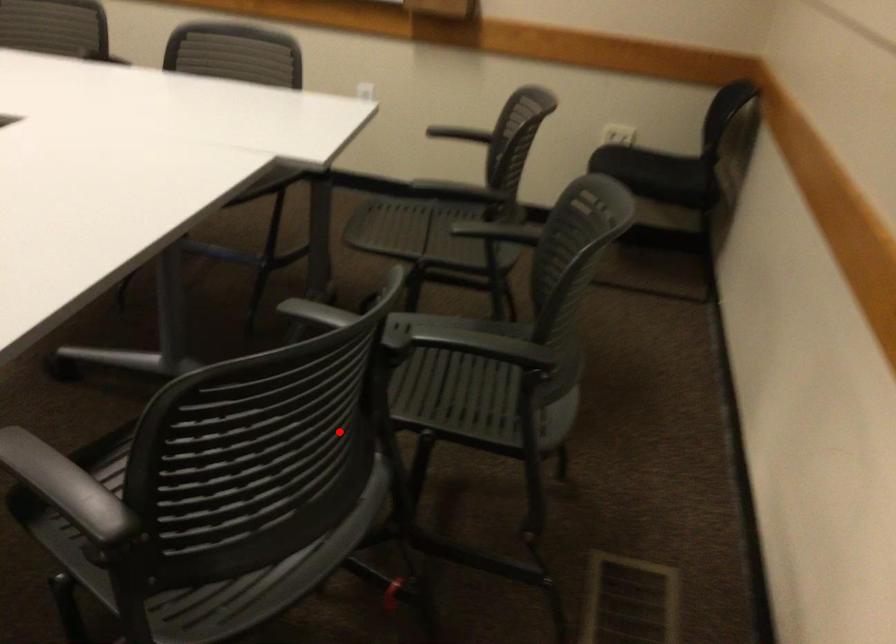
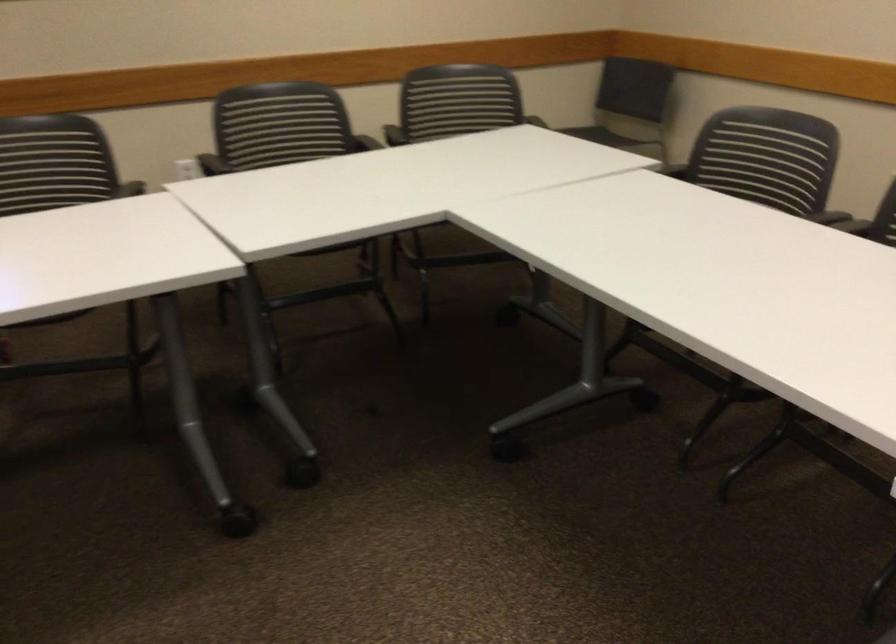
Question: I am providing you with two images of the same scene from different viewpoints. A red point is shown in image1. For the corresponding object point in image2, is it positioned nearer or farther from the camera?

Choices:
 (A) Nearer
 (B) Farther

Answer: (B)